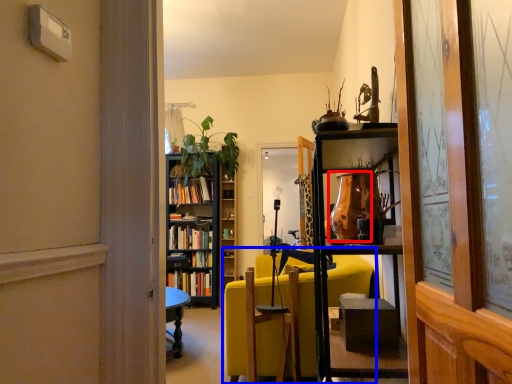
Question: Which object is closer to the camera taking this photo, glass vase (highlighted by a red box) or studio couch (highlighted by a blue box)?

Choices:
 (A) glass vase
 (B) studio couch

Answer: (A)